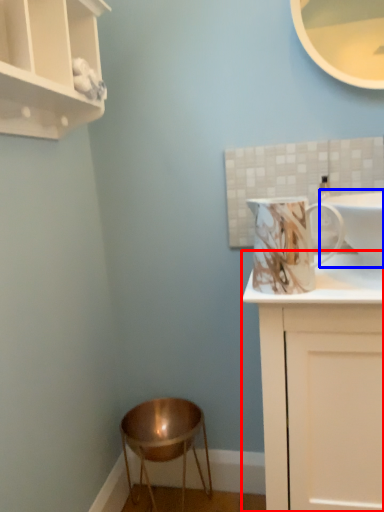
Question: Which object appears closest to the camera in this image, cabinetry (highlighted by a red box) or sink (highlighted by a blue box)?

Choices:
 (A) cabinetry
 (B) sink

Answer: (A)